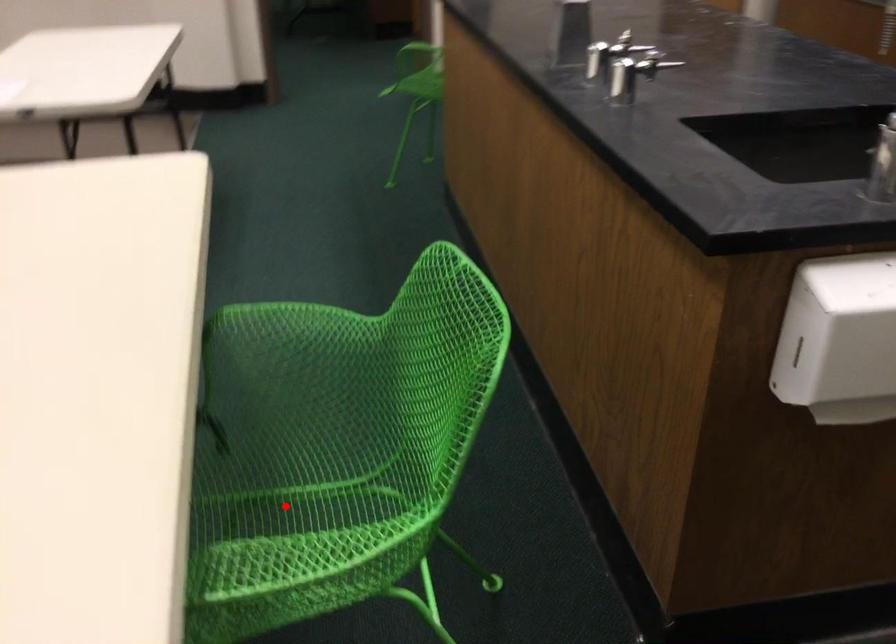
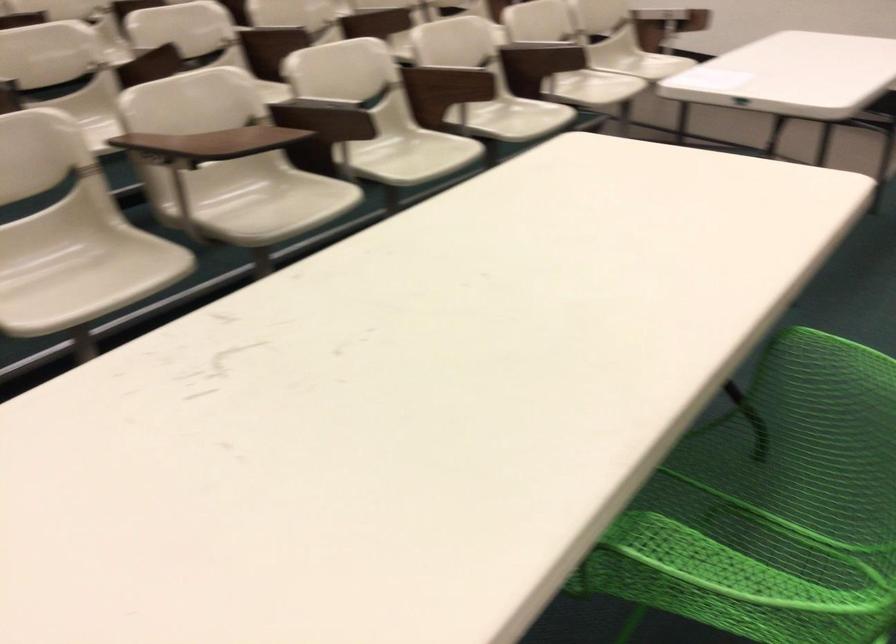
Where in the second image is the point corresponding to the highlighted location from the first image?

(760, 527)